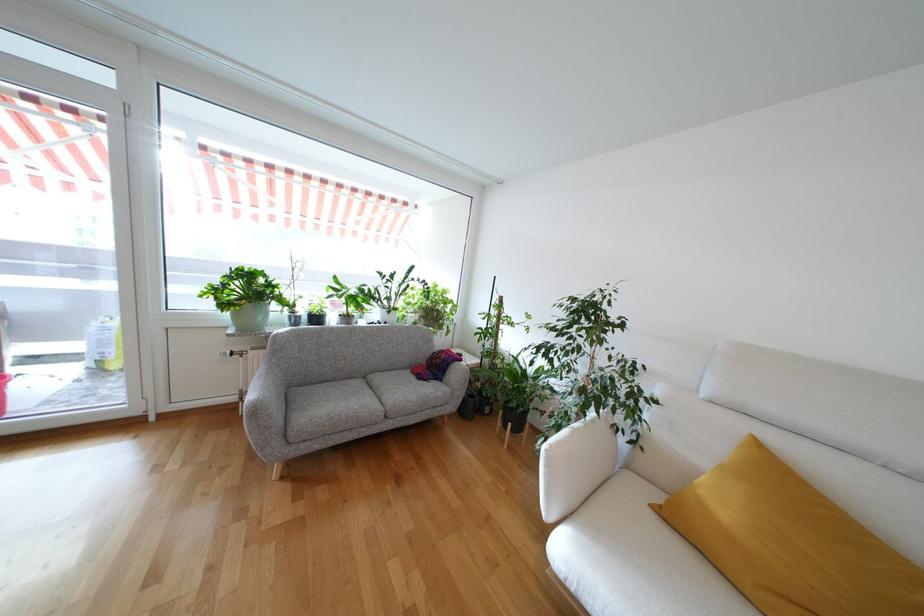
Locate an element on the screen. Image resolution: width=924 pixels, height=616 pixels. white plant pot is located at coordinates (244, 296).